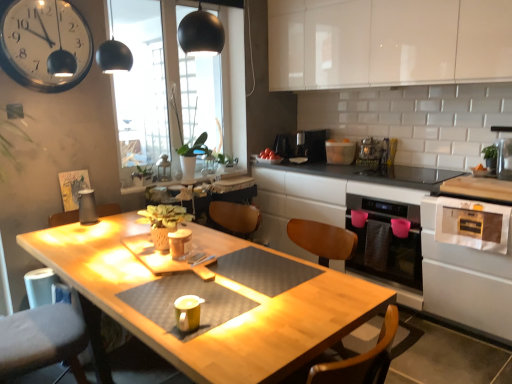
Where is `vacant area located to the right-hand side of matte yellow cup at center, the sixth appliance positioned from the right`? This screenshot has height=384, width=512. vacant area located to the right-hand side of matte yellow cup at center, the sixth appliance positioned from the right is located at coordinates (226, 316).